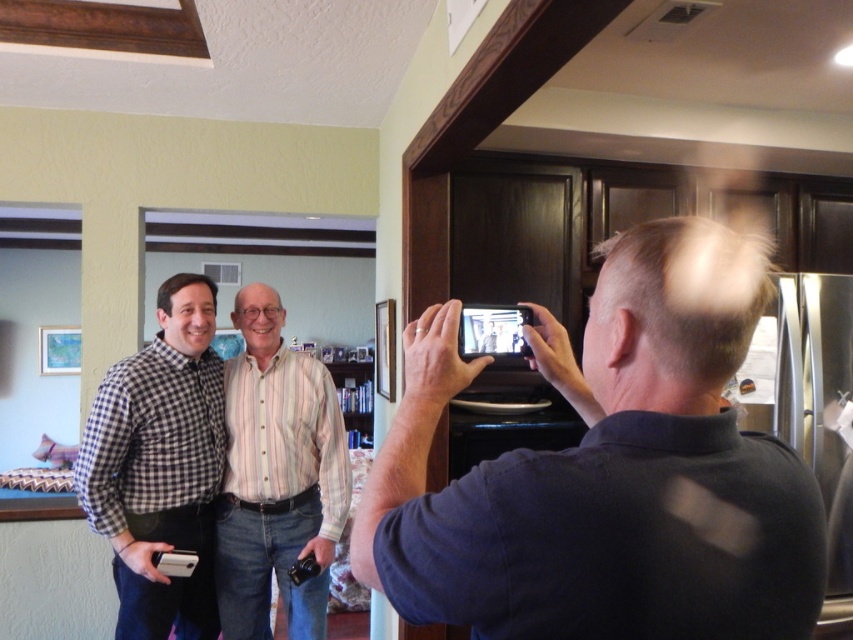
Question: Which object is positioned closest to the striped cotton shirt at center?

Choices:
 (A) checkered fabric shirt at left
 (B) matte black phone at center

Answer: (A)

Question: Which object appears farthest from the camera in this image?

Choices:
 (A) striped cotton shirt at center
 (B) matte black phone at center

Answer: (A)

Question: Is checkered fabric shirt at left below striped cotton shirt at center?

Choices:
 (A) no
 (B) yes

Answer: (A)

Question: Is matte black phone at center positioned before striped cotton shirt at center?

Choices:
 (A) yes
 (B) no

Answer: (A)

Question: Which point is farther to the camera?

Choices:
 (A) matte black phone at center
 (B) striped cotton shirt at center

Answer: (B)

Question: Does matte black phone at center have a greater width compared to striped cotton shirt at center?

Choices:
 (A) yes
 (B) no

Answer: (A)